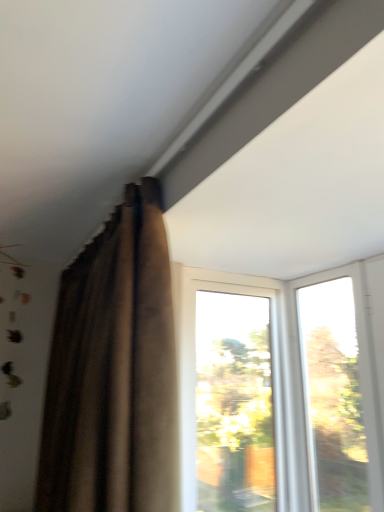
Question: Does transparent glass window at upper right, which ranks as the first window in right-to-left order, come in front of transparent glass window at center, placed as the 2th window when sorted from right to left?

Choices:
 (A) yes
 (B) no

Answer: (A)

Question: Considering the relative sizes of transparent glass window at upper right, which appears as the second window when viewed from the left, and transparent glass window at center, which appears as the first window when viewed from the left, in the image provided, is transparent glass window at upper right, which appears as the second window when viewed from the left, shorter than transparent glass window at center, which appears as the first window when viewed from the left,?

Choices:
 (A) yes
 (B) no

Answer: (A)

Question: Is transparent glass window at upper right, which appears as the second window when viewed from the left, further to the viewer compared to transparent glass window at center, placed as the 2th window when sorted from right to left?

Choices:
 (A) yes
 (B) no

Answer: (B)

Question: Can you confirm if transparent glass window at upper right, which appears as the second window when viewed from the left, is bigger than transparent glass window at center, which appears as the first window when viewed from the left?

Choices:
 (A) no
 (B) yes

Answer: (A)

Question: From the image's perspective, is transparent glass window at upper right, which appears as the second window when viewed from the left, beneath transparent glass window at center, placed as the 2th window when sorted from right to left?

Choices:
 (A) yes
 (B) no

Answer: (B)

Question: Does point (147, 273) appear closer or farther from the camera than point (307, 390)?

Choices:
 (A) farther
 (B) closer

Answer: (B)

Question: Relative to transparent glass window at upper right, which ranks as the first window in right-to-left order, is brown velvet curtain at upper left in front or behind?

Choices:
 (A) behind
 (B) front

Answer: (B)

Question: From the image's perspective, is brown velvet curtain at upper left positioned above or below transparent glass window at upper right, which ranks as the first window in right-to-left order?

Choices:
 (A) below
 (B) above

Answer: (B)

Question: Considering the relative positions of brown velvet curtain at upper left and transparent glass window at upper right, which appears as the second window when viewed from the left, in the image provided, is brown velvet curtain at upper left to the left or to the right of transparent glass window at upper right, which appears as the second window when viewed from the left,?

Choices:
 (A) left
 (B) right

Answer: (A)

Question: Is transparent glass window at upper right, which appears as the second window when viewed from the left, taller or shorter than brown velvet curtain at upper left?

Choices:
 (A) tall
 (B) short

Answer: (B)

Question: From the image's perspective, is transparent glass window at upper right, which appears as the second window when viewed from the left, located above or below brown velvet curtain at upper left?

Choices:
 (A) below
 (B) above

Answer: (A)

Question: Relative to brown velvet curtain at upper left, is transparent glass window at upper right, which appears as the second window when viewed from the left, in front or behind?

Choices:
 (A) behind
 (B) front

Answer: (A)

Question: In terms of width, does transparent glass window at upper right, which appears as the second window when viewed from the left, look wider or thinner when compared to brown velvet curtain at upper left?

Choices:
 (A) thin
 (B) wide

Answer: (A)

Question: Is transparent glass window at center, which appears as the first window when viewed from the left, bigger or smaller than transparent glass window at upper right, which ranks as the first window in right-to-left order?

Choices:
 (A) big
 (B) small

Answer: (A)

Question: Is point (246, 332) positioned closer to the camera than point (367, 340)?

Choices:
 (A) closer
 (B) farther

Answer: (B)